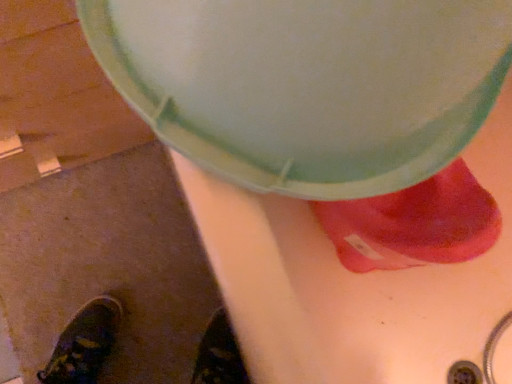
Question: Can matte pink sock at lower right be found inside matte plastic lid at upper center?

Choices:
 (A) no
 (B) yes

Answer: (A)

Question: Is matte plastic lid at upper center positioned with its back to matte pink sock at lower right?

Choices:
 (A) yes
 (B) no

Answer: (B)

Question: Is matte plastic lid at upper center outside matte pink sock at lower right?

Choices:
 (A) yes
 (B) no

Answer: (A)

Question: Is matte plastic lid at upper center further to camera compared to matte pink sock at lower right?

Choices:
 (A) no
 (B) yes

Answer: (A)

Question: From the image's perspective, is matte plastic lid at upper center under matte pink sock at lower right?

Choices:
 (A) no
 (B) yes

Answer: (A)

Question: Does matte plastic lid at upper center have a greater width compared to matte pink sock at lower right?

Choices:
 (A) yes
 (B) no

Answer: (A)

Question: Does matte pink sock at lower right turn towards matte plastic lid at upper center?

Choices:
 (A) yes
 (B) no

Answer: (B)

Question: From a real-world perspective, does matte pink sock at lower right sit lower than matte plastic lid at upper center?

Choices:
 (A) yes
 (B) no

Answer: (A)

Question: From the image's perspective, is matte pink sock at lower right above matte plastic lid at upper center?

Choices:
 (A) no
 (B) yes

Answer: (A)

Question: Is matte pink sock at lower right turned away from matte plastic lid at upper center?

Choices:
 (A) no
 (B) yes

Answer: (A)

Question: Can you see matte pink sock at lower right touching matte plastic lid at upper center?

Choices:
 (A) no
 (B) yes

Answer: (A)

Question: Can we say matte pink sock at lower right lies outside matte plastic lid at upper center?

Choices:
 (A) yes
 (B) no

Answer: (A)

Question: In the image, is matte plastic lid at upper center positioned in front of or behind matte pink sock at lower right?

Choices:
 (A) front
 (B) behind

Answer: (A)